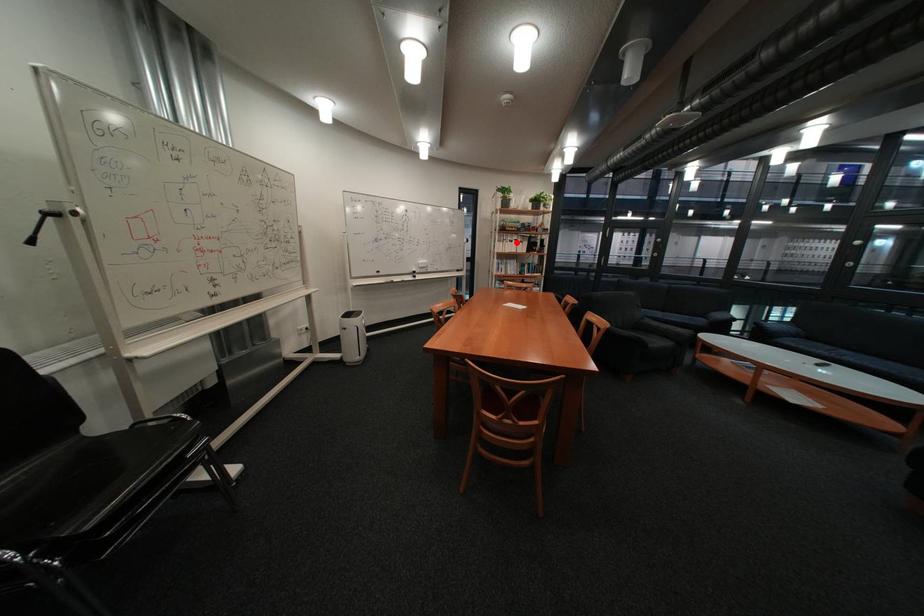
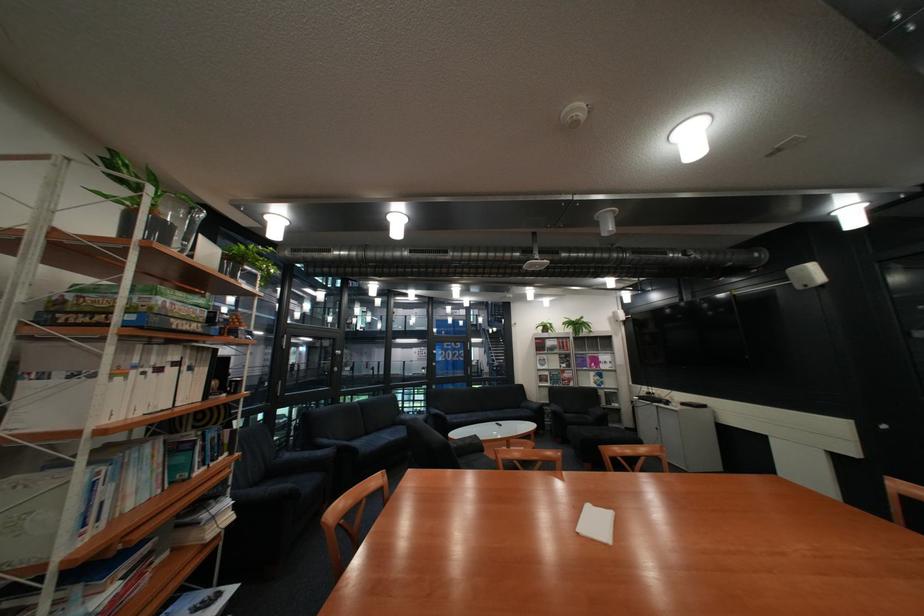
Question: I am providing you with two images of the same scene from different viewpoints. Image1 has a red point marked. In image2, the corresponding 3D location appears at what relative position? Reply with the corresponding letter.

Choices:
 (A) Closer
 (B) Farther

Answer: (B)